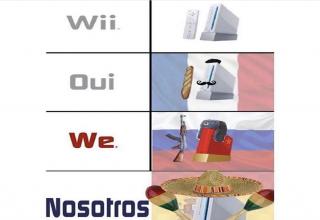
Where is `game console with mustache`? The height and width of the screenshot is (220, 320). game console with mustache is located at coordinates (x=222, y=82), (x=207, y=83).